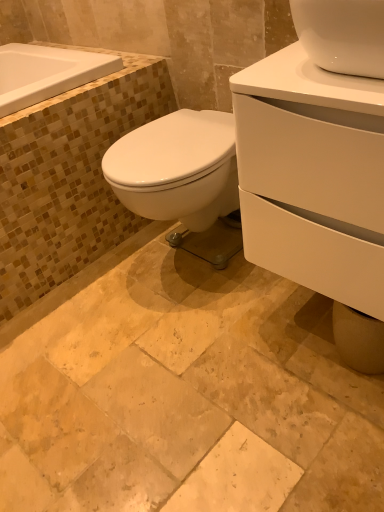
Question: In terms of height, does natural stone tile at center look taller or shorter compared to white glossy cabinet at right?

Choices:
 (A) short
 (B) tall

Answer: (A)

Question: Looking at their shapes, would you say natural stone tile at center is wider or thinner than white glossy cabinet at right?

Choices:
 (A) thin
 (B) wide

Answer: (B)

Question: Which is farther from the white glossy cabinet at right?

Choices:
 (A) natural stone tile at center
 (B) white glossy bathtub at upper left

Answer: (B)

Question: Considering the real-world distances, which object is farthest from the natural stone tile at center?

Choices:
 (A) white glossy cabinet at right
 (B) white glossy bathtub at upper left

Answer: (B)